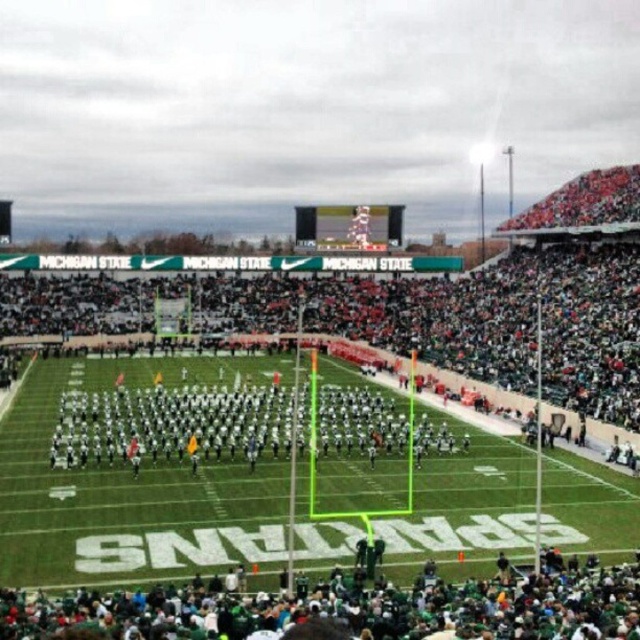
Question: Which point is farther to the camera?

Choices:
 (A) green fabric crowd at lower center
 (B) white uniformed players at center

Answer: (B)

Question: Can you confirm if green fabric crowd at lower center is positioned above white uniformed players at center?

Choices:
 (A) no
 (B) yes

Answer: (A)

Question: Which point is closer to the camera taking this photo?

Choices:
 (A) (481, 612)
 (B) (440, 435)

Answer: (A)

Question: Is green fabric crowd at lower center to the left of white uniformed players at center from the viewer's perspective?

Choices:
 (A) yes
 (B) no

Answer: (B)

Question: Is green fabric crowd at lower center further to the viewer compared to white uniformed players at center?

Choices:
 (A) yes
 (B) no

Answer: (B)

Question: Which object appears farthest from the camera in this image?

Choices:
 (A) green fabric crowd at lower center
 (B) white uniformed players at center

Answer: (B)